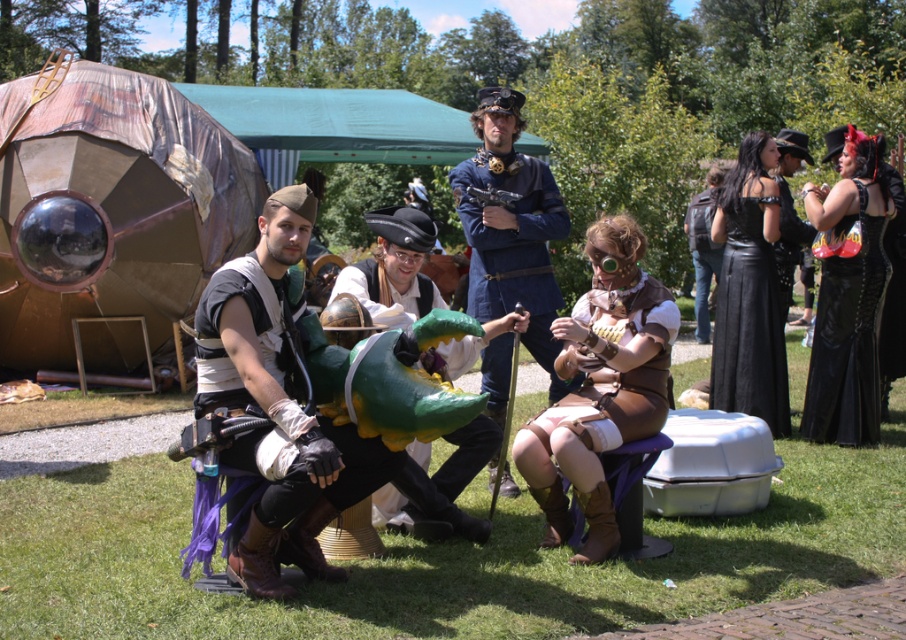
You are organizing a costume party and need to decide which costume to store first. Since you have limited space, you want to store the smaller one first. Which costume should you store first between the blue fabric coat at center and the black leather jacket at upper right?

The black leather jacket at upper right should be stored first because it is smaller than the blue fabric coat at center according to the description.

You are standing in the middle of the event and see two points marked in the image. Which point, point (x=748, y=369) or point (x=878, y=288), is closer to you?

Point (x=748, y=369) is closer to you because it is further to the viewer than point (x=878, y=288).

You are a photographer at the event and need to position a spotlight on the black leather jacket at upper right and the black leather vest at center. Based on their positions, which one requires the spotlight to be placed higher to illuminate properly?

The black leather jacket at upper right is located below the black leather vest at center, so the spotlight for the black leather jacket at upper right should be placed lower than the one for the black leather vest at center to properly illuminate both.